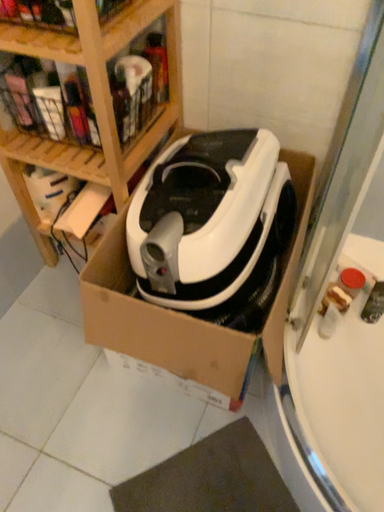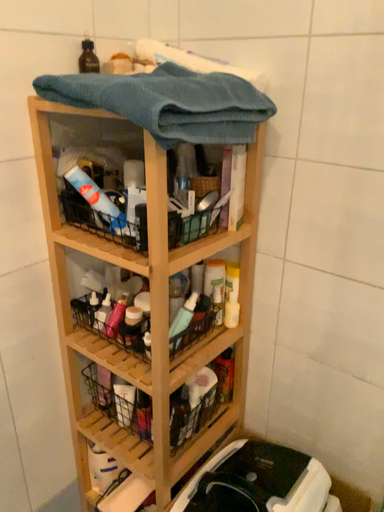
Question: Which way did the camera rotate in the video?

Choices:
 (A) rotated right
 (B) rotated left

Answer: (B)